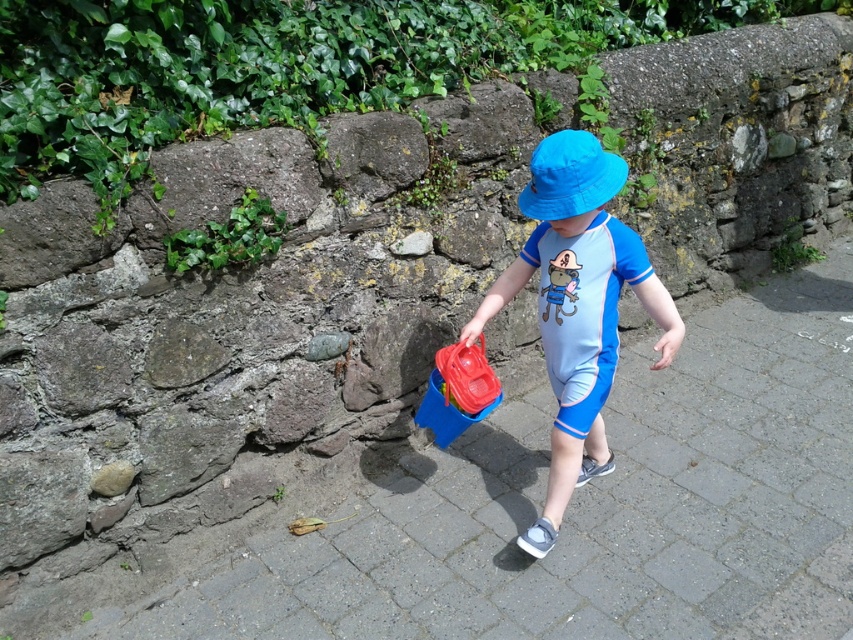
Question: Which point is farther to the camera?

Choices:
 (A) (589, 179)
 (B) (775, 326)

Answer: (B)

Question: Does blue paved stone at center appear under blue fabric hat at center?

Choices:
 (A) yes
 (B) no

Answer: (A)

Question: Which object is farther from the camera taking this photo?

Choices:
 (A) blue matte swimsuit at center
 (B) blue paved stone at center

Answer: (A)

Question: Does blue matte swimsuit at center appear under blue fabric hat at center?

Choices:
 (A) yes
 (B) no

Answer: (A)

Question: Which point is closer to the camera taking this photo?

Choices:
 (A) (424, 512)
 (B) (552, 536)

Answer: (B)

Question: Does blue paved stone at center have a larger size compared to blue matte swimsuit at center?

Choices:
 (A) no
 (B) yes

Answer: (B)